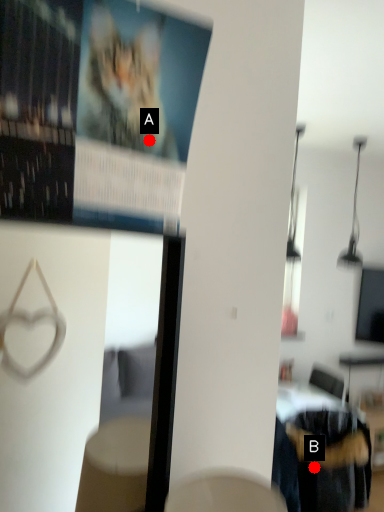
Question: Two points are circled on the image, labeled by A and B beside each circle. Which of the following is the farthest from the observer?

Choices:
 (A) A is further
 (B) B is further

Answer: (B)